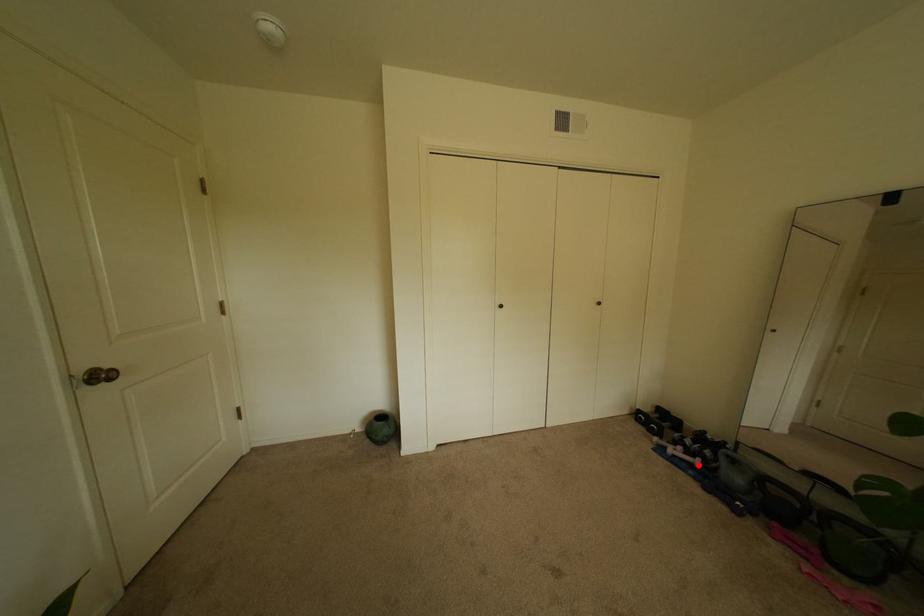
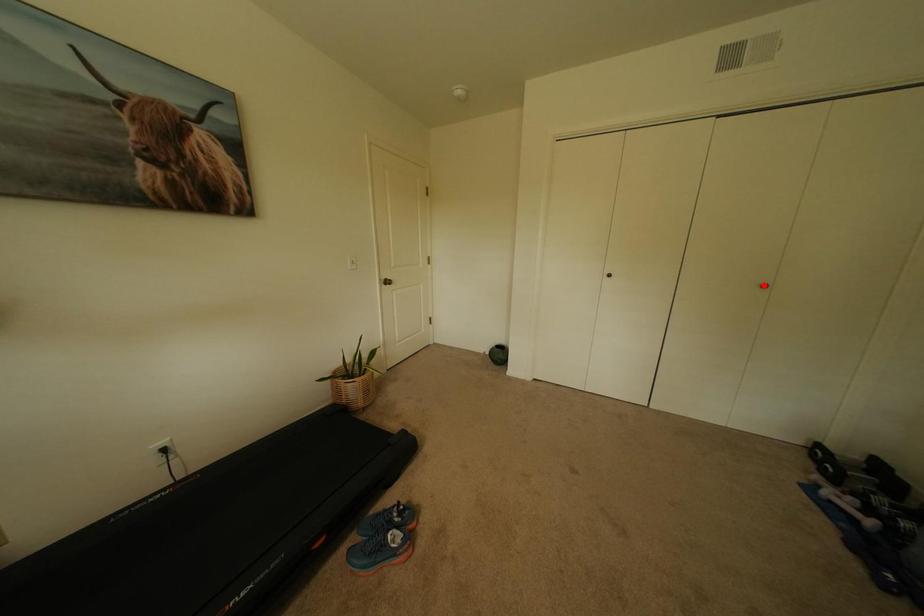
I am providing you with two images of the same scene from different viewpoints. A red point is marked on the first image and another point is marked on the second image. Are the points marked in image1 and image2 representing the same 3D position?

No